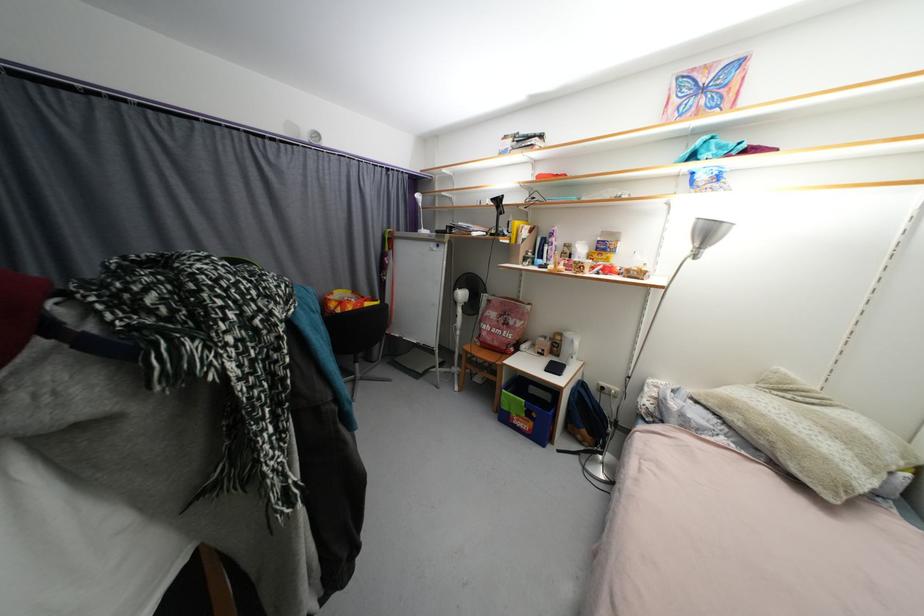
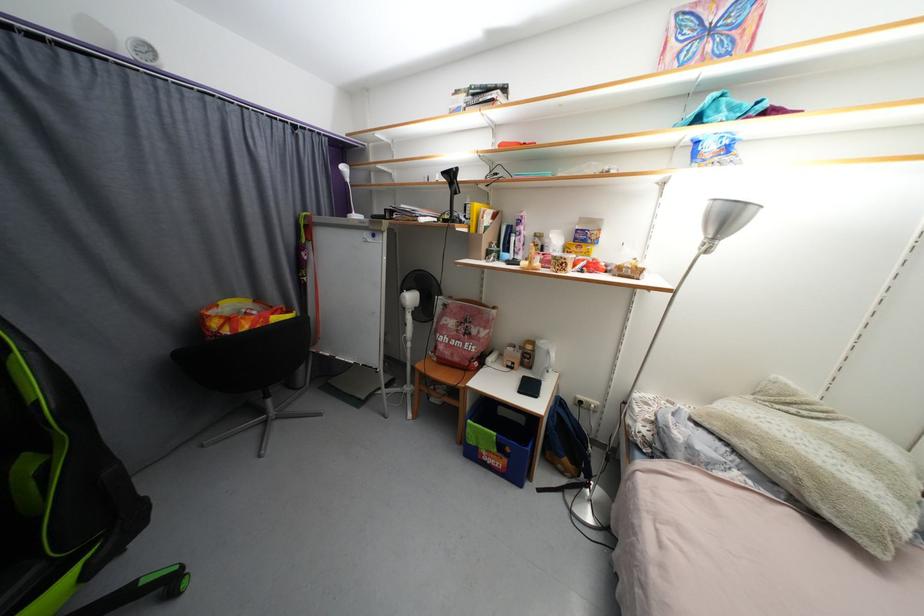
In the second image, find the point that corresponds to pixel 565 336 in the first image.

(538, 344)